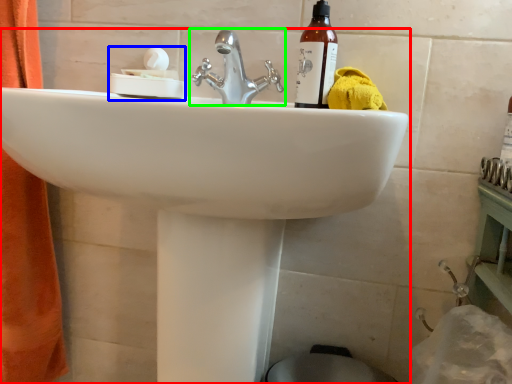
Question: Considering the real-world distances, which object is closest to sink (highlighted by a red box)? tissue (highlighted by a blue box) or tap (highlighted by a green box).

Choices:
 (A) tissue
 (B) tap

Answer: (B)